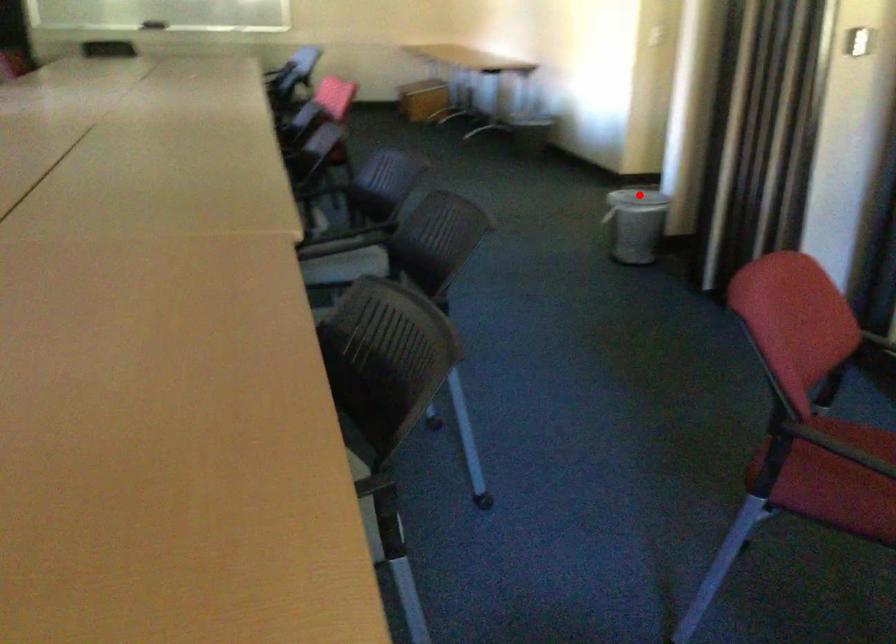
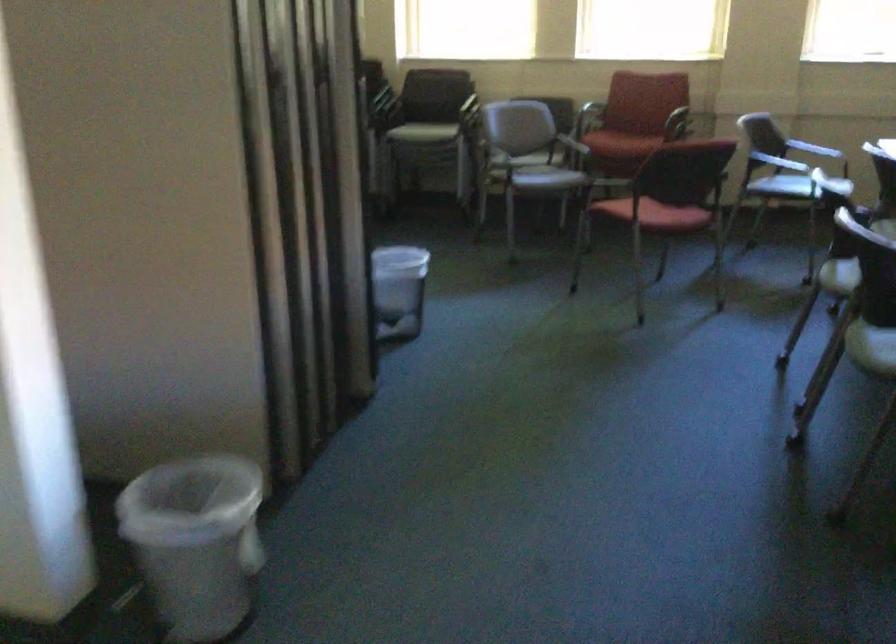
In the second image, find the point that corresponds to the highlighted location in the first image.

(195, 542)